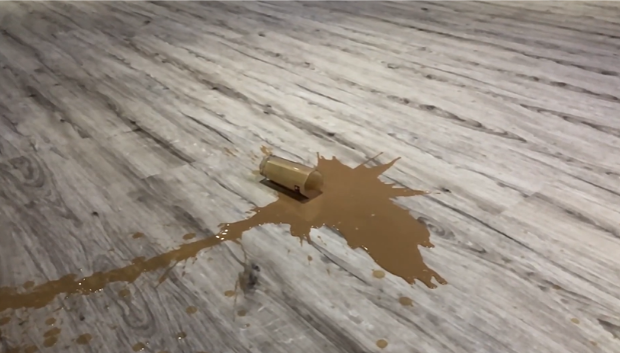
At what (x,y) coordinates should I click in order to perform the action: click on spilled drink. Please return your answer as a coordinate pair (x, y). The image size is (620, 353). Looking at the image, I should click on (342, 214).